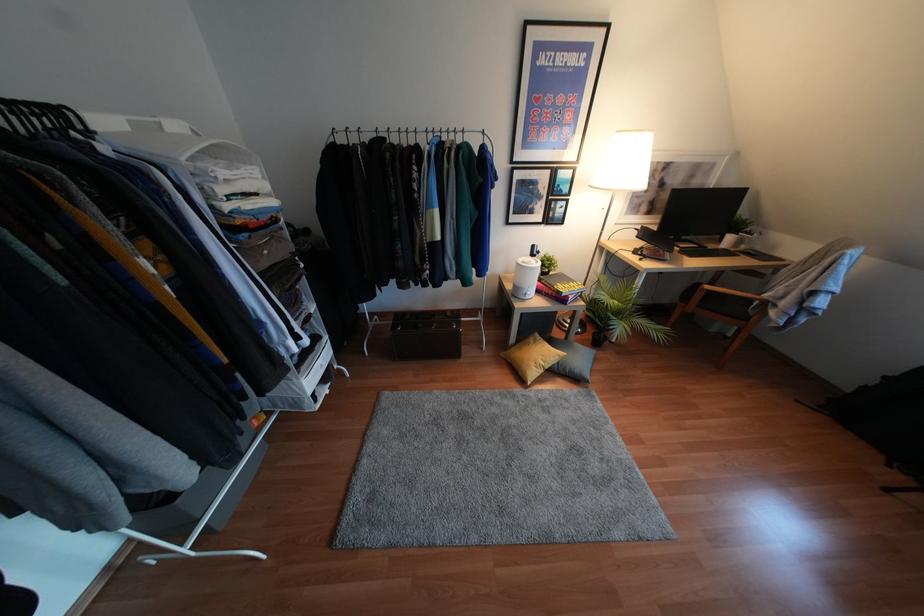
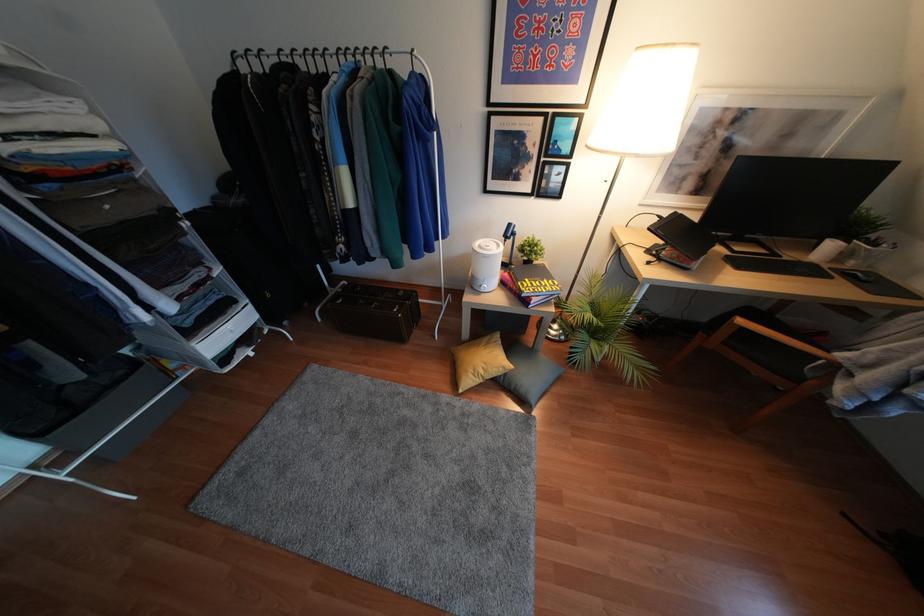
The point at (550,254) is marked in the first image. Where is the corresponding point in the second image?

(536, 237)